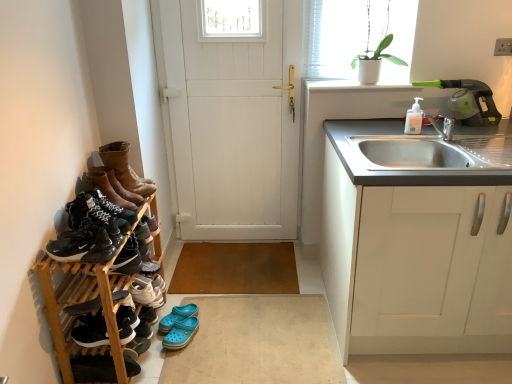
Locate an element on the screen. Image resolution: width=512 pixels, height=384 pixels. free space in front of blue rubber clogs at lower center, arranged as the third footwear when ordered from the bottom is located at coordinates (174, 343).